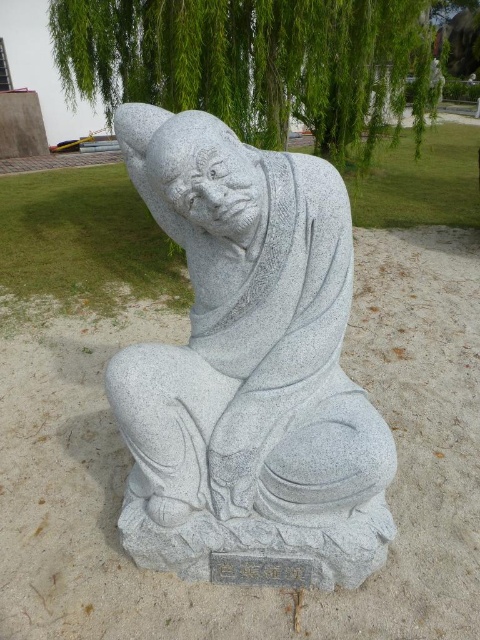
Question: Which object appears closest to the camera in this image?

Choices:
 (A) gray stone statue at center
 (B) green leafy tree at upper center

Answer: (A)

Question: Which point is closer to the camera?

Choices:
 (A) gray stone statue at center
 (B) green leafy tree at upper center

Answer: (A)

Question: Considering the relative positions of gray stone statue at center and green leafy tree at upper center in the image provided, where is gray stone statue at center located with respect to green leafy tree at upper center?

Choices:
 (A) left
 (B) right

Answer: (A)

Question: Is gray stone statue at center wider than green leafy tree at upper center?

Choices:
 (A) yes
 (B) no

Answer: (B)

Question: Does gray stone statue at center lie behind green leafy tree at upper center?

Choices:
 (A) no
 (B) yes

Answer: (A)